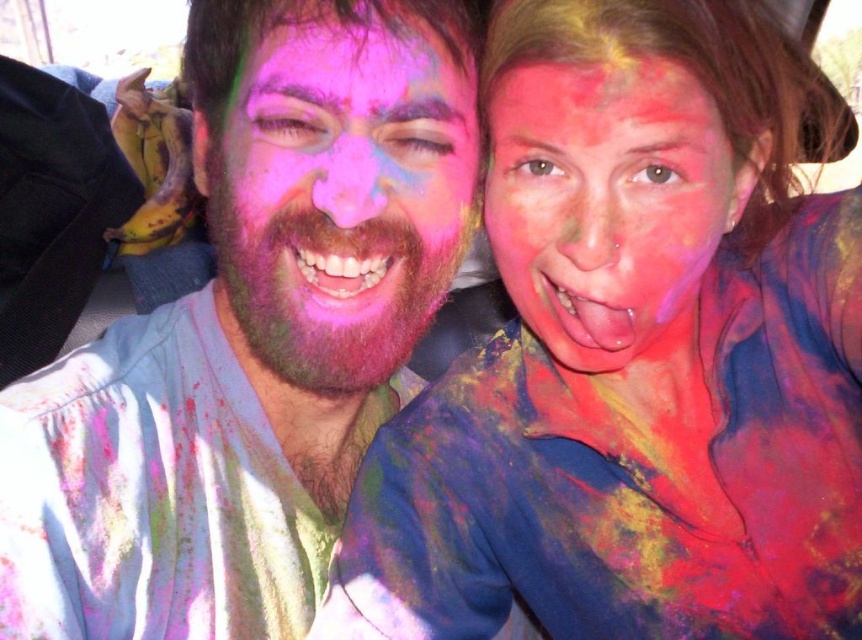
Which of these two, matte multicolored face paint at center or matte multicolored face at center, stands taller?

matte multicolored face at center

Can you confirm if matte multicolored face paint at center is smaller than matte multicolored face at center?

Indeed, matte multicolored face paint at center has a smaller size compared to matte multicolored face at center.

Where is `matte multicolored face paint at center`? The image size is (862, 640). matte multicolored face paint at center is located at coordinates (634, 355).

Is point (651, 452) positioned behind point (332, 314)?

Yes, it is behind point (332, 314).

Can you confirm if matte multicolored face paint at center is shorter than pink matte face at center?

Incorrect, matte multicolored face paint at center's height does not fall short of pink matte face at center's.

I want to click on matte multicolored face paint at center, so click(x=634, y=355).

Where is `matte multicolored face paint at center`? The width and height of the screenshot is (862, 640). matte multicolored face paint at center is located at coordinates (634, 355).

Does matte multicolored face paint at center have a greater width compared to multicolored powder at center?

Yes.

Which is more to the right, matte multicolored face paint at center or multicolored powder at center?

From the viewer's perspective, matte multicolored face paint at center appears more on the right side.

Measure the distance between matte multicolored face paint at center and camera.

62.73 centimeters

In order to click on matte multicolored face paint at center in this screenshot , I will do `click(634, 355)`.